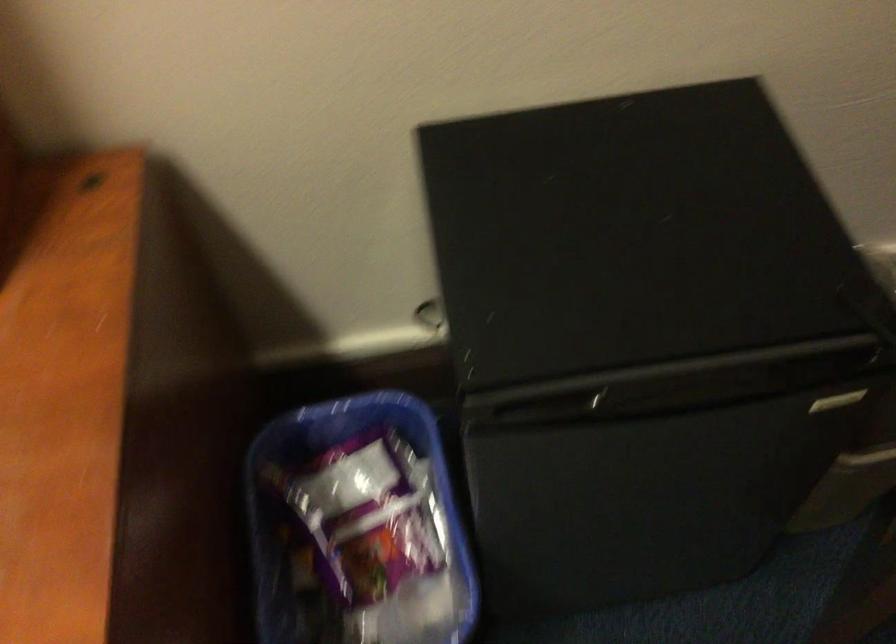
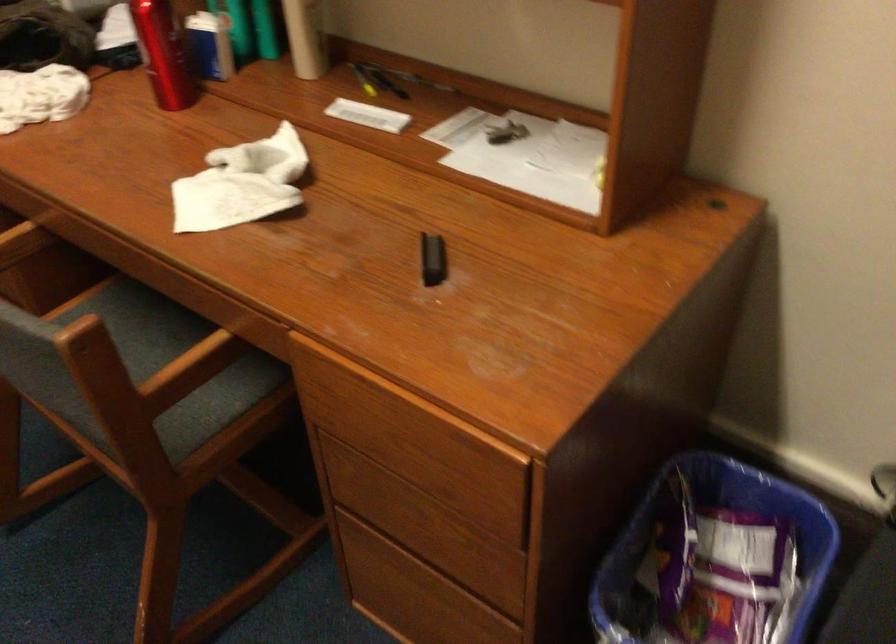
Question: The first image is from the beginning of the video and the second image is from the end. How did the camera likely rotate when shooting the video?

Choices:
 (A) Left
 (B) Right
 (C) Up
 (D) Down

Answer: (A)